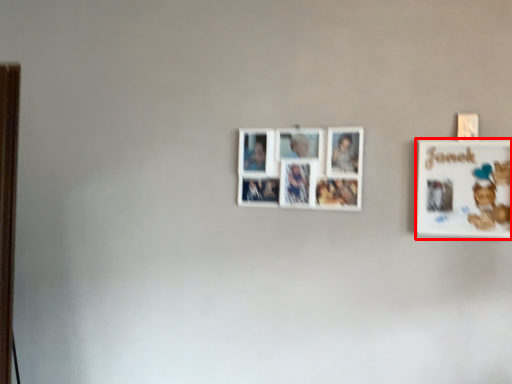
Question: From the image's perspective, considering the relative positions of picture frame (annotated by the red box) and picture frame in the image provided, where is picture frame (annotated by the red box) located with respect to the staircase?

Choices:
 (A) above
 (B) below

Answer: (B)